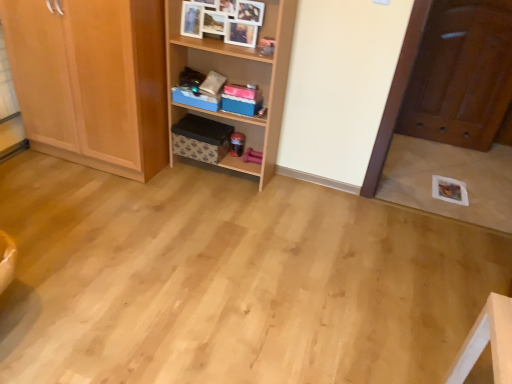
Question: From a real-world perspective, is wooden shelf at center on top of light wood cabinet at left?

Choices:
 (A) no
 (B) yes

Answer: (B)

Question: Is wooden shelf at center bigger than light wood cabinet at left?

Choices:
 (A) yes
 (B) no

Answer: (B)

Question: Considering the relative positions of wooden shelf at center and light wood cabinet at left in the image provided, is wooden shelf at center behind light wood cabinet at left?

Choices:
 (A) no
 (B) yes

Answer: (B)

Question: Is light wood cabinet at left at the back of wooden shelf at center?

Choices:
 (A) yes
 (B) no

Answer: (B)

Question: From the image's perspective, is wooden shelf at center located beneath light wood cabinet at left?

Choices:
 (A) yes
 (B) no

Answer: (A)

Question: Considering the relative positions of wooden cabinet at upper center and shiny brown door at right in the image provided, is wooden cabinet at upper center to the left or to the right of shiny brown door at right?

Choices:
 (A) left
 (B) right

Answer: (A)

Question: From their relative heights in the image, would you say wooden cabinet at upper center is taller or shorter than shiny brown door at right?

Choices:
 (A) tall
 (B) short

Answer: (B)

Question: From a real-world perspective, relative to shiny brown door at right, is wooden cabinet at upper center vertically above or below?

Choices:
 (A) above
 (B) below

Answer: (A)

Question: Is wooden cabinet at upper center wider or thinner than shiny brown door at right?

Choices:
 (A) thin
 (B) wide

Answer: (A)

Question: From a real-world perspective, is blue fabric storage box at center physically located above or below shiny brown door at right?

Choices:
 (A) above
 (B) below

Answer: (B)

Question: Looking at the image, does blue fabric storage box at center seem bigger or smaller compared to shiny brown door at right?

Choices:
 (A) small
 (B) big

Answer: (A)

Question: Which is correct: blue fabric storage box at center is inside shiny brown door at right, or outside of it?

Choices:
 (A) inside
 (B) outside

Answer: (B)

Question: Is blue fabric storage box at center wider or thinner than shiny brown door at right?

Choices:
 (A) thin
 (B) wide

Answer: (B)

Question: From the image's perspective, is brown cardboard box at center located above or below blue fabric storage box at center?

Choices:
 (A) above
 (B) below

Answer: (B)

Question: Is brown cardboard box at center in front of or behind blue fabric storage box at center in the image?

Choices:
 (A) behind
 (B) front

Answer: (A)